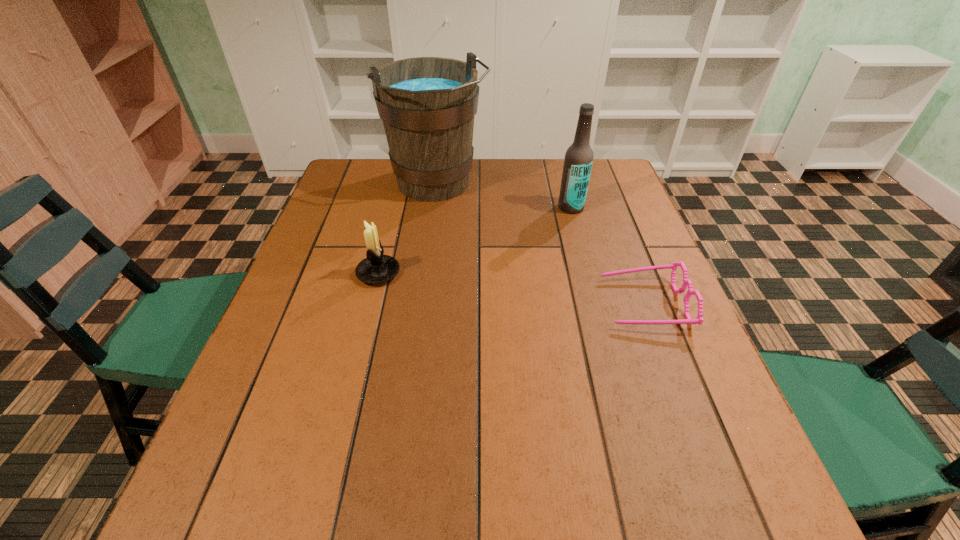
At what (x,y) coordinates should I click in order to perform the action: click on blank area located with a handle on the side of the wine bucket. Please return your answer as a coordinate pair (x, y). This screenshot has height=540, width=960. Looking at the image, I should click on (508, 276).

Identify the location of vacant space situated 0.280m on the label of the beer bottle. The width and height of the screenshot is (960, 540). pos(512,266).

I want to click on vacant space situated 0.210m on the label of the beer bottle, so coord(526,252).

In order to click on vacant space located 0.310m on the label of the beer bottle in this screenshot , I will do `click(505, 273)`.

Locate an element on the screen. object that is at the far edge is located at coordinates point(427,104).

Where is `candle holder present at the left edge`? This screenshot has height=540, width=960. candle holder present at the left edge is located at coordinates (377, 268).

Identify the location of wine bucket at the left edge. The image size is (960, 540). (427, 104).

At what (x,y) coordinates should I click in order to perform the action: click on spectacles at the right edge. Please return your answer as a coordinate pair (x, y). This screenshot has width=960, height=540. Looking at the image, I should click on (699, 319).

The width and height of the screenshot is (960, 540). I want to click on beer bottle that is at the right edge, so click(578, 160).

The width and height of the screenshot is (960, 540). I want to click on object that is at the far left corner, so pos(427,104).